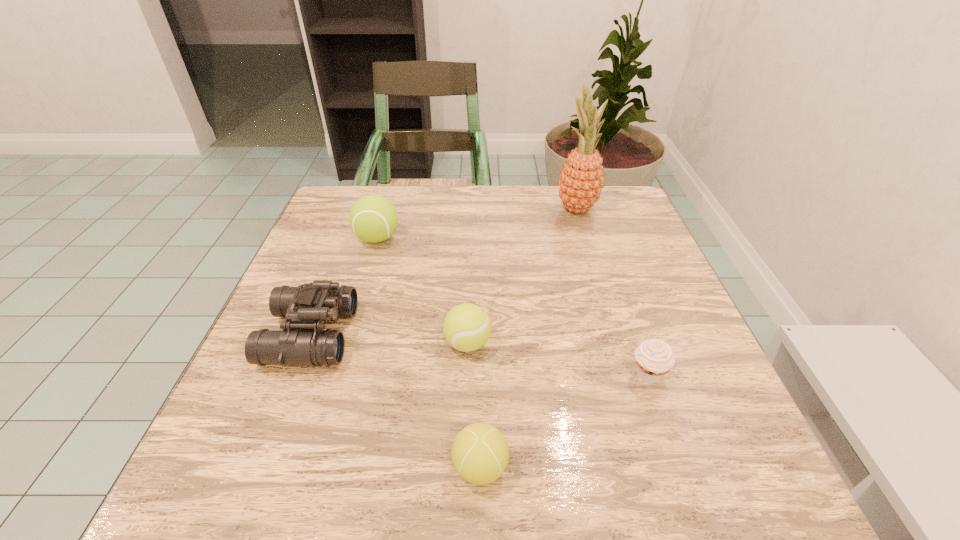
Find the location of a particular element. free point that satisfies the following two spatial constraints: 1. on the back side of the nearest tennis ball; 2. through the lenses of the binoculars is located at coordinates (480, 335).